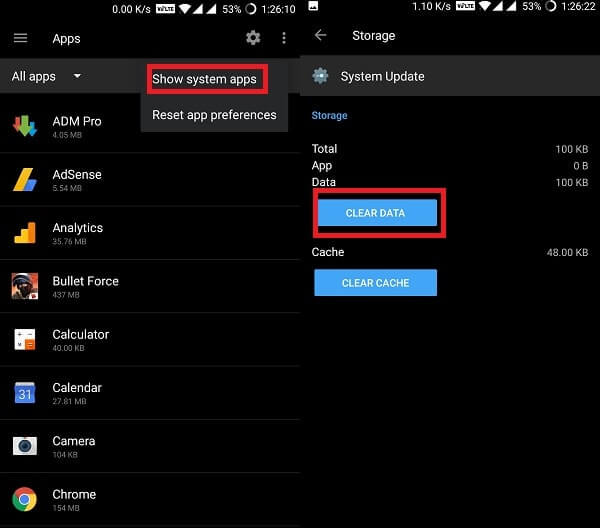
I want to click on calendar, so [x=24, y=399].